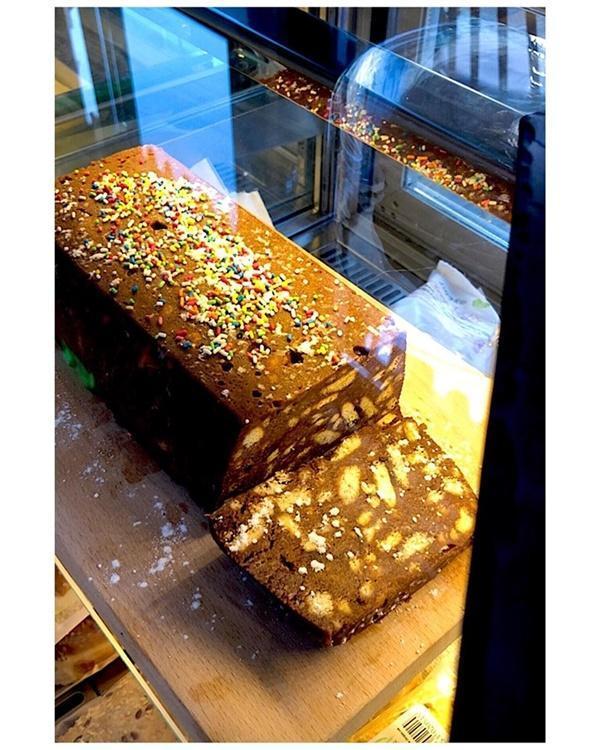
Image resolution: width=600 pixels, height=750 pixels. What are the coordinates of `door frame` in the screenshot? It's located at (x=461, y=237).